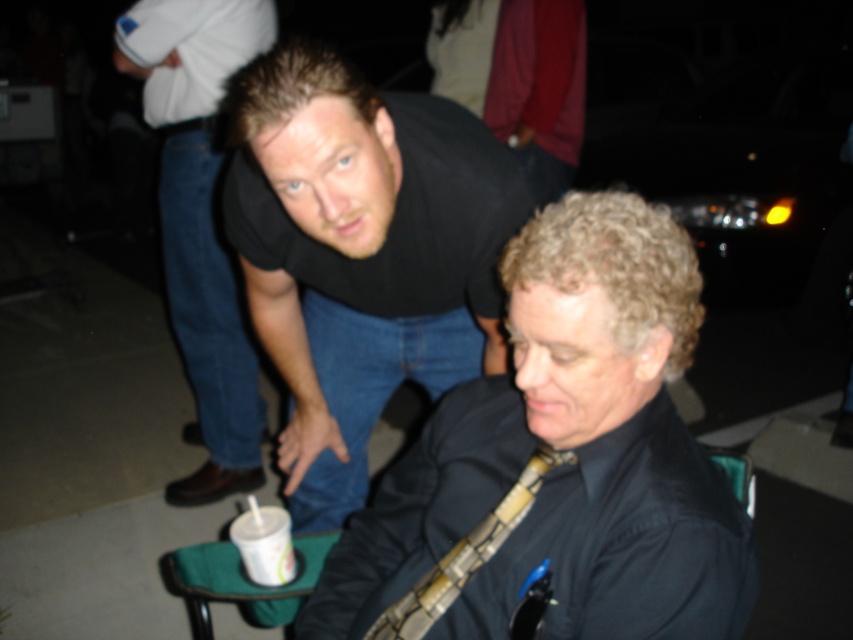
What object is located at the coordinates point (361, 253)?

The point (361, 253) marks the location of the black matte shirt at upper center.

You are organizing a party and need to place a large poster on the wall behind the matte black shirt at upper center and the white paper cup at lower left. Which object should you avoid covering to ensure the poster doesn

You should avoid covering the matte black shirt at upper center because it is larger than the white paper cup at lower left, so covering it might block more of the poster.

You are a photographer trying to capture both the matte black shirt at upper center and the white paper cup at lower left in a single frame. Based on their sizes in the image, which object should you focus on first to ensure both are in focus?

The matte black shirt at upper center is taller than the white paper cup at lower left, so focusing on the taller matte black shirt at upper center first would help ensure both are in focus since it requires adjusting focus for the greater distance or depth.